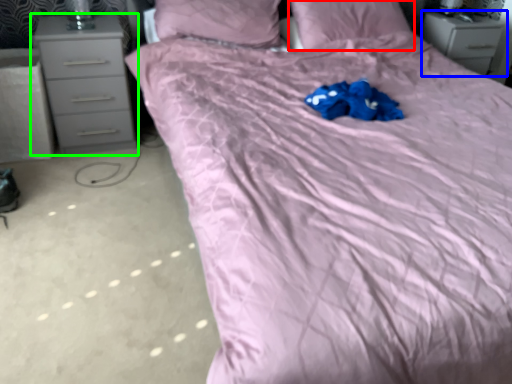
Question: Considering the real-world distances, which object is farthest from pillow (highlighted by a red box)? chest of drawers (highlighted by a blue box) or chest of drawers (highlighted by a green box)?

Choices:
 (A) chest of drawers
 (B) chest of drawers

Answer: (B)